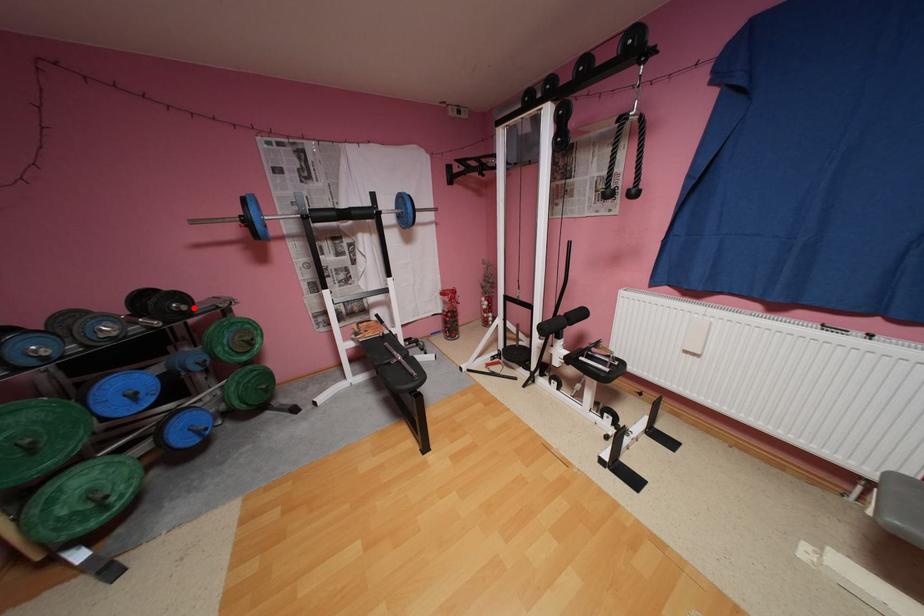
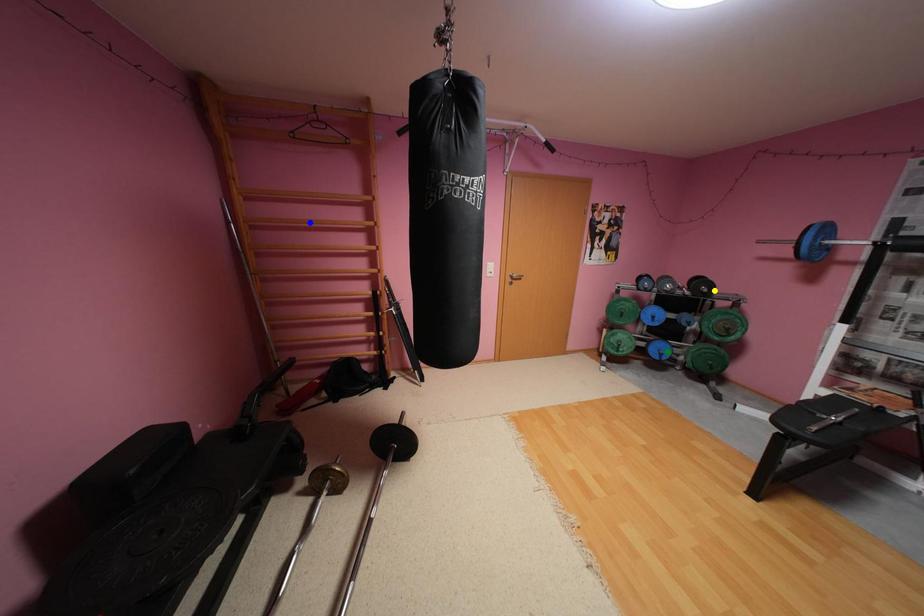
Question: I am providing you with two images of the same scene from different viewpoints. A red point is marked on the first image. You are given multiple points on the second image. Which spot in image 2 lines up with the point in image 1?

Choices:
 (A) green point
 (B) blue point
 (C) yellow point

Answer: (C)